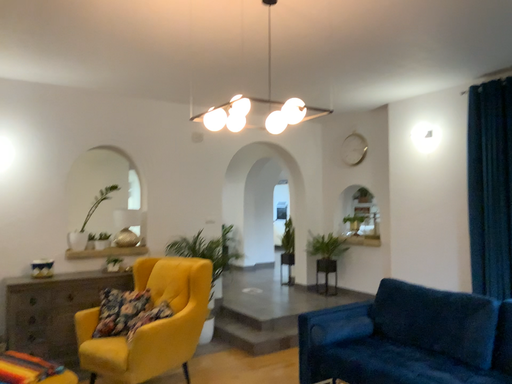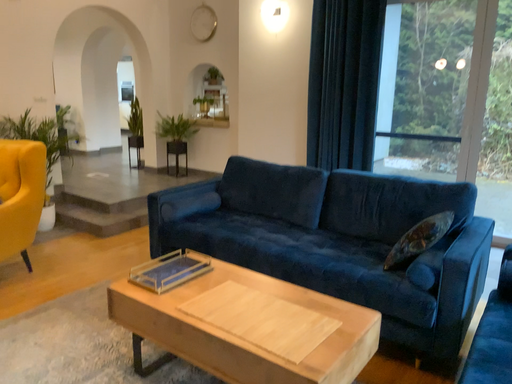
Question: Which way did the camera rotate in the video?

Choices:
 (A) rotated left
 (B) rotated right

Answer: (B)